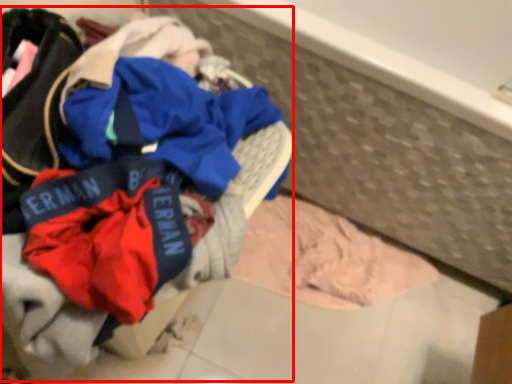
Question: Where is laundry (annotated by the red box) located in relation to baby clothe in the image?

Choices:
 (A) left
 (B) right

Answer: (A)